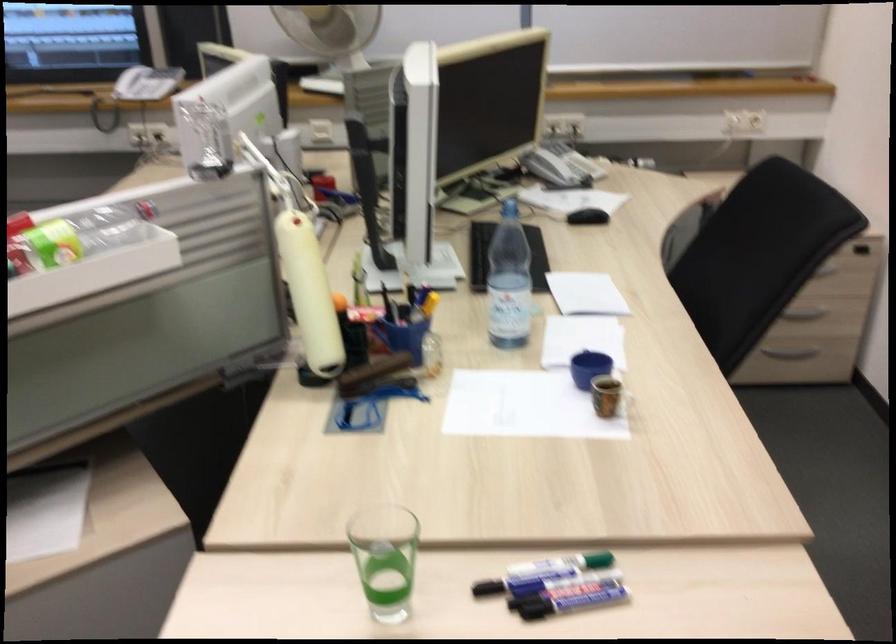
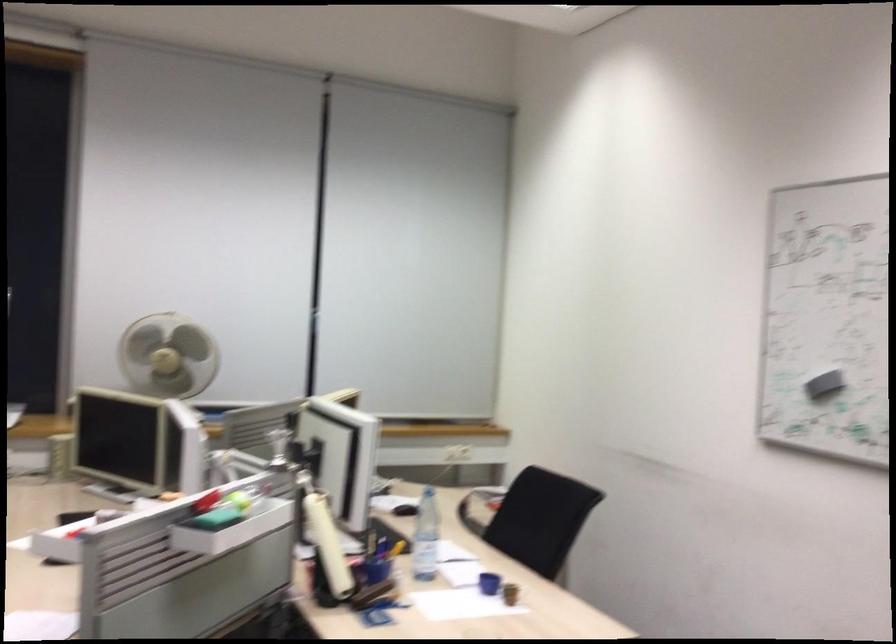
Locate, in the second image, the point that corresponds to (587,384) in the first image.

(488, 583)